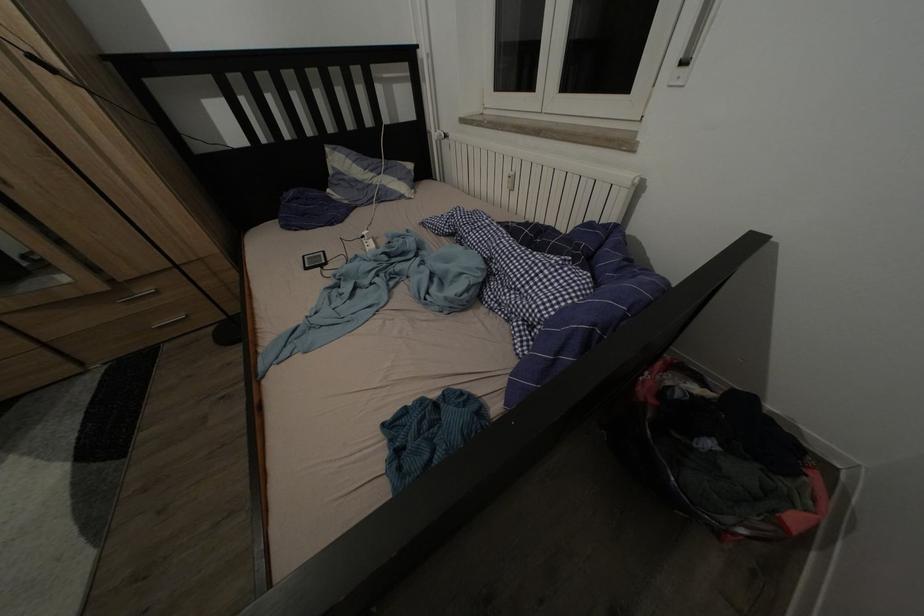
You are a GUI agent. You are given a task and a screenshot of the screen. Output one action in this format:
    pyautogui.click(x=<x>, y=<y>)
    Task: Click on the white power adapter
    This screenshot has height=616, width=924.
    Given the screenshot: What is the action you would take?
    pyautogui.click(x=371, y=236)